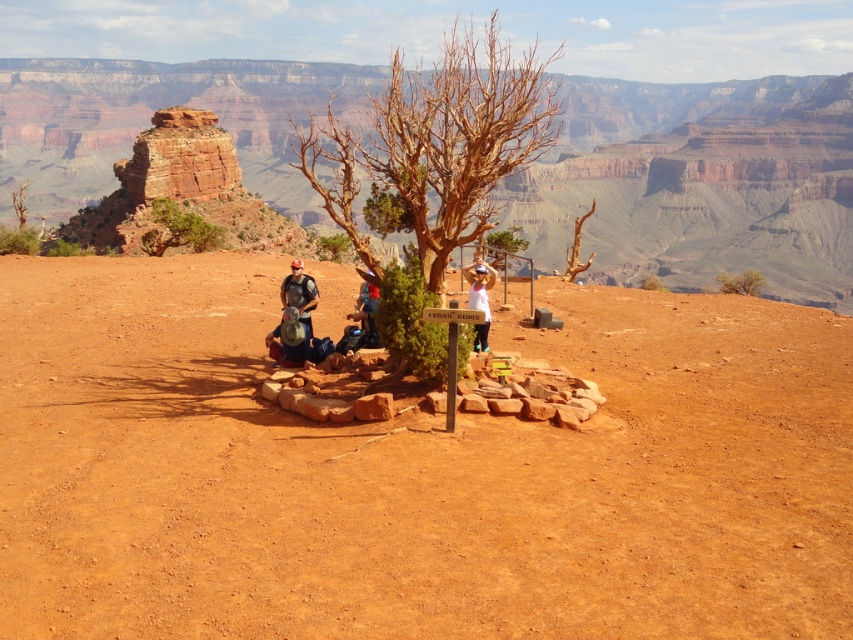
You are standing at the base of the Grand Canyon and see two points marked in the image. The first point is at coordinate point (706, 355) and the second is at point (305, 324). Which point is closer to your current position?

Point (706, 355) is further to the viewer than point (305, 324), so the second point at (305, 324) is closer to your current position.

You are a photographer trying to capture the matte black backpack at center and the green leafy bush at right in the same frame. Based on their heights, which object will appear smaller in the photo?

The matte black backpack at center appears smaller in the photo because it has a lesser height compared to the green leafy bush at right.

You are a photographer planning to take a picture of the dull red dirt at center and the white fabric at center. Based on their positions, which object should you focus on first if you want to capture both in a single frame without moving the camera?

The dull red dirt at center is positioned on the left side of white fabric at center, so you should focus on the dull red dirt at center first to ensure both objects are in the frame.